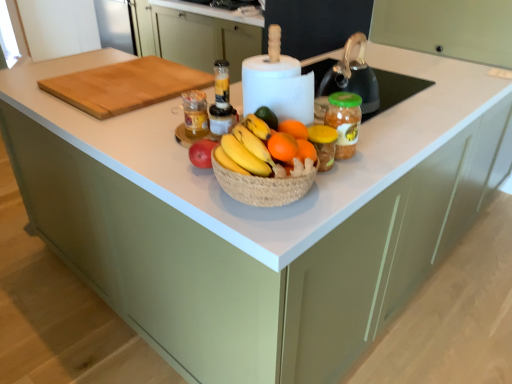
Find the location of a particular element. The image size is (512, 384). green plastic jar at center is located at coordinates (344, 121).

The width and height of the screenshot is (512, 384). What do you see at coordinates (125, 85) in the screenshot?
I see `natural wood cutting board at upper left` at bounding box center [125, 85].

Find the location of `orangesmoothfruit at center`. orangesmoothfruit at center is located at coordinates (283, 147).

The width and height of the screenshot is (512, 384). What do you see at coordinates (222, 102) in the screenshot?
I see `translucent plastic blender at center, which is the 2th bottle in left-to-right order` at bounding box center [222, 102].

Find the location of `green plastic jar at center`. green plastic jar at center is located at coordinates (344, 121).

Between natural wood cutting board at upper left and green plastic jar at center, which one appears on the right side from the viewer's perspective?

green plastic jar at center is more to the right.

Is natural wood cutting board at upper left taller or shorter than green plastic jar at center?

Clearly, natural wood cutting board at upper left is shorter compared to green plastic jar at center.

This screenshot has height=384, width=512. Find the location of `glass jar on the right of natural wood cutting board at upper left`. glass jar on the right of natural wood cutting board at upper left is located at coordinates (344, 121).

Considering the relative sizes of natural wood cutting board at upper left and green plastic jar at center in the image provided, is natural wood cutting board at upper left smaller than green plastic jar at center?

No, natural wood cutting board at upper left is not smaller than green plastic jar at center.

Between translucent plastic blender at center, the 1th bottle when ordered from right to left, and natural wood cutting board at upper left, which one appears on the right side from the viewer's perspective?

translucent plastic blender at center, the 1th bottle when ordered from right to left, is more to the right.

In the scene shown: Is translucent plastic blender at center, which is the 2th bottle in left-to-right order, spatially inside natural wood cutting board at upper left, or outside of it?

translucent plastic blender at center, which is the 2th bottle in left-to-right order, is not enclosed by natural wood cutting board at upper left.

Is translucent plastic blender at center, which is the 2th bottle in left-to-right order, facing away from natural wood cutting board at upper left?

No, translucent plastic blender at center, which is the 2th bottle in left-to-right order, is not facing away from natural wood cutting board at upper left.

Would you consider translucent plastic blender at center, which is the 2th bottle in left-to-right order, to be distant from natural wood cutting board at upper left?

That's not correct — translucent plastic blender at center, which is the 2th bottle in left-to-right order, is a little close to natural wood cutting board at upper left.

From the image's perspective, does green plastic jar at center appear higher than translucent plastic blender at center, which is the 2th bottle in left-to-right order?

No.

Is the depth of green plastic jar at center greater than that of translucent plastic blender at center, which is the 2th bottle in left-to-right order?

No, green plastic jar at center is closer to the viewer.

Is green plastic jar at center looking in the opposite direction of translucent plastic blender at center, which is the 2th bottle in left-to-right order?

No, green plastic jar at center is not facing the opposite direction of translucent plastic blender at center, which is the 2th bottle in left-to-right order.

Considering the positions of points (281, 154) and (219, 81), is point (281, 154) closer to camera compared to point (219, 81)?

Yes, it is in front of point (219, 81).

Can you confirm if orangesmoothfruit at center is shorter than translucent plastic blender at center, the 1th bottle when ordered from right to left?

Indeed, orangesmoothfruit at center has a lesser height compared to translucent plastic blender at center, the 1th bottle when ordered from right to left.

Is orangesmoothfruit at center completely or partially outside of translucent plastic blender at center, the 1th bottle when ordered from right to left?

Yes.

Between orangesmoothfruit at center and translucent plastic blender at center, which is the 2th bottle in left-to-right order, which one appears on the right side from the viewer's perspective?

orangesmoothfruit at center.

Is the surface of translucent glass jar at center, marked as the 1th bottle in a left-to-right arrangement, in direct contact with orange matte grapefruit at center?

They are not placed beside each other.

In the image, there is a orange matte grapefruit at center. Where is `bottle below it (from a real-world perspective)`? Image resolution: width=512 pixels, height=384 pixels. bottle below it (from a real-world perspective) is located at coordinates (195, 114).

How much distance is there between translucent glass jar at center, the 2th bottle viewed from the right, and orange matte grapefruit at center?

10.27 inches.

Looking at this image, considering the sizes of translucent glass jar at center, marked as the 1th bottle in a left-to-right arrangement, and orange matte grapefruit at center in the image, is translucent glass jar at center, marked as the 1th bottle in a left-to-right arrangement, taller or shorter than orange matte grapefruit at center?

In the image, translucent glass jar at center, marked as the 1th bottle in a left-to-right arrangement, appears to be taller than orange matte grapefruit at center.

Considering the positions of objects green plastic jar at center and orangesmoothfruit at center in the image provided, who is more to the right, green plastic jar at center or orangesmoothfruit at center?

green plastic jar at center is more to the right.

From the image's perspective, is green plastic jar at center located above or below orangesmoothfruit at center?

Clearly, from the image's perspective, green plastic jar at center is above orangesmoothfruit at center.

Can we say green plastic jar at center lies outside orangesmoothfruit at center?

Yes, green plastic jar at center is located beyond the bounds of orangesmoothfruit at center.

Is green plastic jar at center positioned with its back to orangesmoothfruit at center?

No.

Between translucent plastic blender at center, the 1th bottle when ordered from right to left, and green plastic jar at center, which one has less height?

translucent plastic blender at center, the 1th bottle when ordered from right to left.

Considering their positions, is translucent plastic blender at center, the 1th bottle when ordered from right to left, located in front of or behind green plastic jar at center?

In the image, translucent plastic blender at center, the 1th bottle when ordered from right to left, appears behind green plastic jar at center.

Between point (219, 117) and point (330, 109), which one is positioned behind?

Point (219, 117)

This screenshot has width=512, height=384. What are the coordinates of `the 1st bottle counting from the left of the green plastic jar at center` in the screenshot? It's located at (222, 102).

Identify the location of glass jar on the right of natural wood cutting board at upper left. (344, 121).

From a real-world perspective, count 2nd bottles upward from the natural wood cutting board at upper left and point to it. Please provide its 2D coordinates.

[(222, 102)]

Looking at the image, which one is located closer to natural wood cutting board at upper left, orange matte grapefruit at center or green plastic jar at center?

orange matte grapefruit at center is positioned closer to the anchor natural wood cutting board at upper left.

Considering their positions, is translucent glass jar at center, the 2th bottle viewed from the right, positioned closer to natural wood cutting board at upper left than green plastic jar at center?

Among the two, translucent glass jar at center, the 2th bottle viewed from the right, is located nearer to natural wood cutting board at upper left.

Looking at the image, which one is located further to green plastic jar at center, natural wood cutting board at upper left or translucent glass jar at center, the 2th bottle viewed from the right?

natural wood cutting board at upper left lies further to green plastic jar at center than the other object.

Considering their positions, is natural wood cutting board at upper left positioned further to translucent glass jar at center, the 2th bottle viewed from the right, than orangesmoothfruit at center?

orangesmoothfruit at center lies further to translucent glass jar at center, the 2th bottle viewed from the right, than the other object.

Which object lies nearer to the anchor point translucent glass jar at center, marked as the 1th bottle in a left-to-right arrangement, orange matte grapefruit at center or natural wood cutting board at upper left?

Based on the image, orange matte grapefruit at center appears to be nearer to translucent glass jar at center, marked as the 1th bottle in a left-to-right arrangement.

When comparing their distances from orangesmoothfruit at center, does green plastic jar at center or orange matte grapefruit at center seem further?

green plastic jar at center.

From the image, which object appears to be nearer to natural wood cutting board at upper left, orangesmoothfruit at center or orange matte grapefruit at center?

orange matte grapefruit at center is positioned closer to the anchor natural wood cutting board at upper left.

When comparing their distances from natural wood cutting board at upper left, does translucent plastic blender at center, which is the 2th bottle in left-to-right order, or green plastic jar at center seem further?

Based on the image, green plastic jar at center appears to be further to natural wood cutting board at upper left.

Identify the location of grapefruit situated between translucent plastic blender at center, the 1th bottle when ordered from right to left, and green plastic jar at center from left to right. This screenshot has width=512, height=384. [265, 150].

This screenshot has height=384, width=512. Identify the location of grapefruit between natural wood cutting board at upper left and green plastic jar at center in the horizontal direction. (265, 150).

The width and height of the screenshot is (512, 384). I want to click on bottle between natural wood cutting board at upper left and translucent plastic blender at center, which is the 2th bottle in left-to-right order, in the horizontal direction, so click(x=195, y=114).

At what (x,y) coordinates should I click in order to perform the action: click on orange situated between translucent glass jar at center, marked as the 1th bottle in a left-to-right arrangement, and green plastic jar at center from left to right. Please return your answer as a coordinate pair (x, y). The width and height of the screenshot is (512, 384). Looking at the image, I should click on (283, 147).